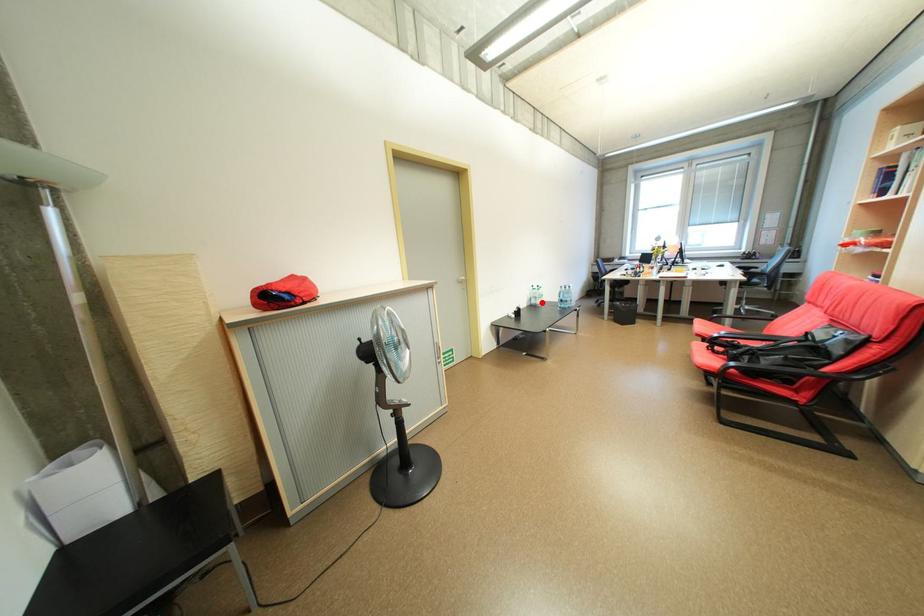
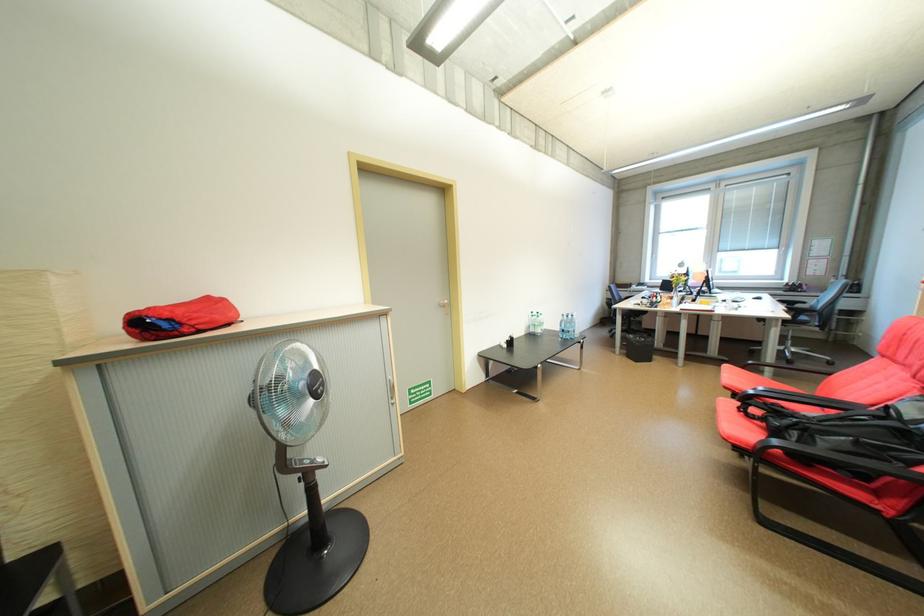
Question: I am providing you with two images of the same scene from different viewpoints. Given a red point in image1, look at the same physical point in image2. Is it:

Choices:
 (A) Closer to the viewpoint
 (B) Farther from the viewpoint

Answer: (B)